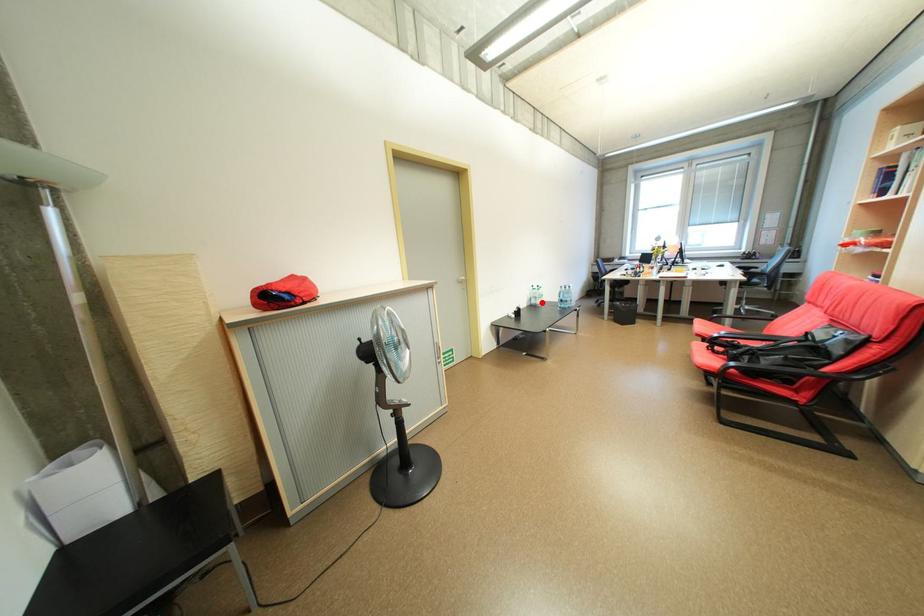
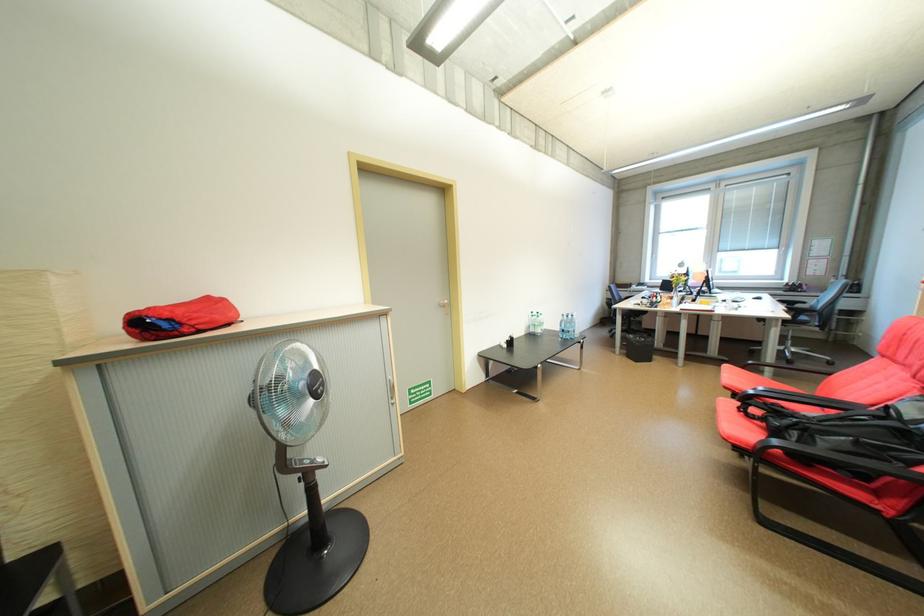
Question: I am providing you with two images of the same scene from different viewpoints. Given a red point in image1, look at the same physical point in image2. Is it:

Choices:
 (A) Closer to the viewpoint
 (B) Farther from the viewpoint

Answer: (B)